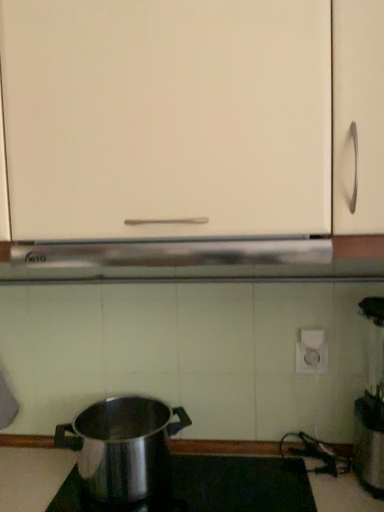
Question: Can you confirm if polished stainless steel pot at lower left is bigger than polished stainless steel pot at lower center?

Choices:
 (A) yes
 (B) no

Answer: (A)

Question: Is polished stainless steel pot at lower left outside of polished stainless steel pot at lower center?

Choices:
 (A) no
 (B) yes

Answer: (B)

Question: Can you confirm if polished stainless steel pot at lower left is positioned to the right of polished stainless steel pot at lower center?

Choices:
 (A) yes
 (B) no

Answer: (B)

Question: Is polished stainless steel pot at lower left directly adjacent to polished stainless steel pot at lower center?

Choices:
 (A) yes
 (B) no

Answer: (B)

Question: Does polished stainless steel pot at lower left lie in front of polished stainless steel pot at lower center?

Choices:
 (A) yes
 (B) no

Answer: (B)

Question: Is polished stainless steel pot at lower left thinner than polished stainless steel pot at lower center?

Choices:
 (A) no
 (B) yes

Answer: (B)

Question: From a real-world perspective, is polished stainless steel pot at lower left under white matte cabinet at center?

Choices:
 (A) no
 (B) yes

Answer: (B)

Question: Can you confirm if polished stainless steel pot at lower left is taller than white matte cabinet at center?

Choices:
 (A) yes
 (B) no

Answer: (B)

Question: Can we say polished stainless steel pot at lower left lies outside white matte cabinet at center?

Choices:
 (A) no
 (B) yes

Answer: (B)

Question: From the image's perspective, is polished stainless steel pot at lower left over white matte cabinet at center?

Choices:
 (A) yes
 (B) no

Answer: (B)

Question: Is polished stainless steel pot at lower left oriented away from white matte cabinet at center?

Choices:
 (A) no
 (B) yes

Answer: (A)

Question: Does polished stainless steel pot at lower left appear on the right side of white matte cabinet at center?

Choices:
 (A) no
 (B) yes

Answer: (A)

Question: From the image's perspective, does white matte cabinet at center appear lower than polished stainless steel pot at lower left?

Choices:
 (A) yes
 (B) no

Answer: (B)